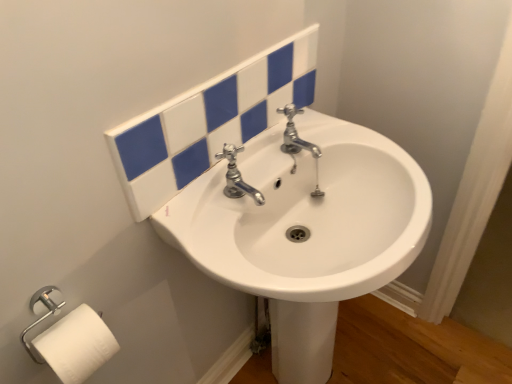
Locate an element on the screen. This screenshot has width=512, height=384. vacant space situated on the left part of polished chrome faucet at center is located at coordinates (201, 213).